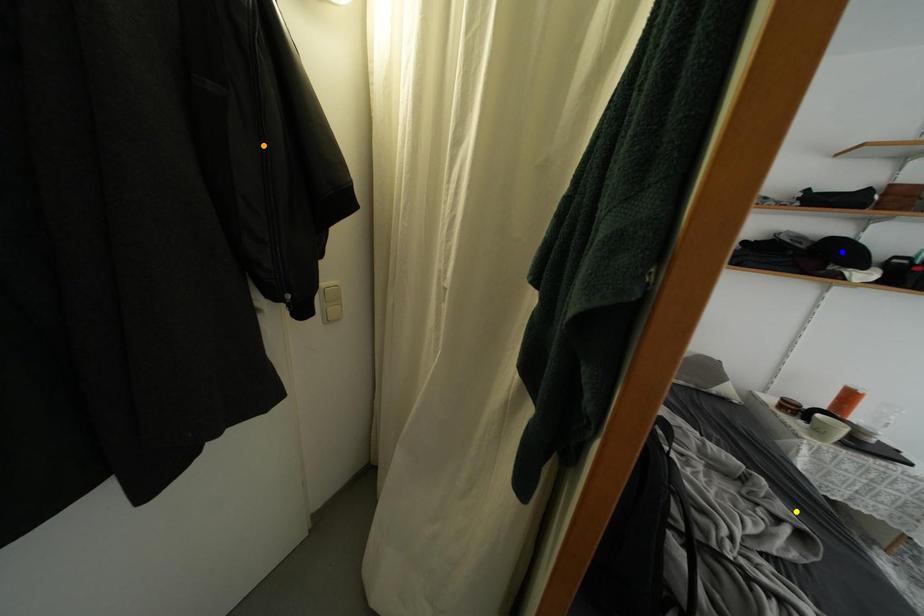
Order these from nearest to farthest:
orange point, blue point, yellow point

orange point, yellow point, blue point